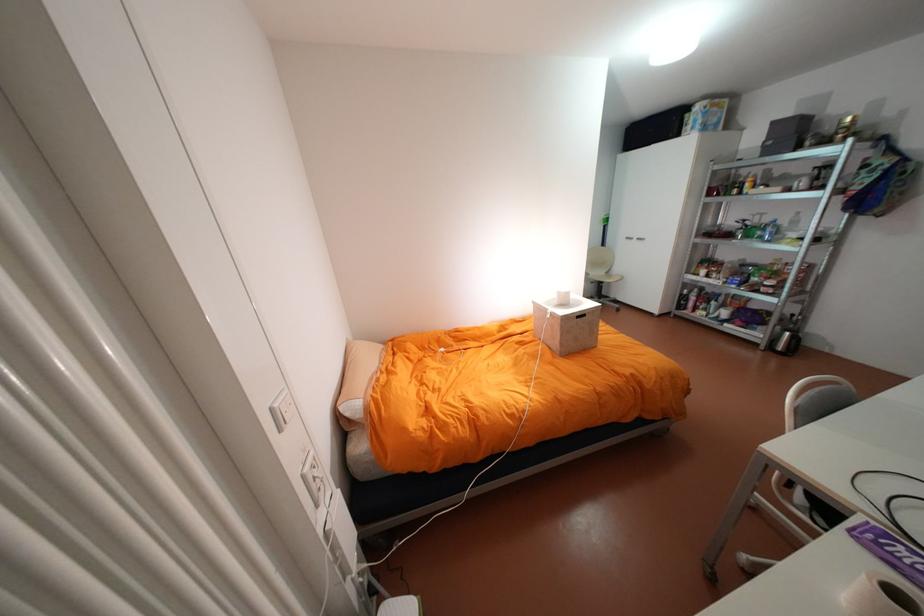
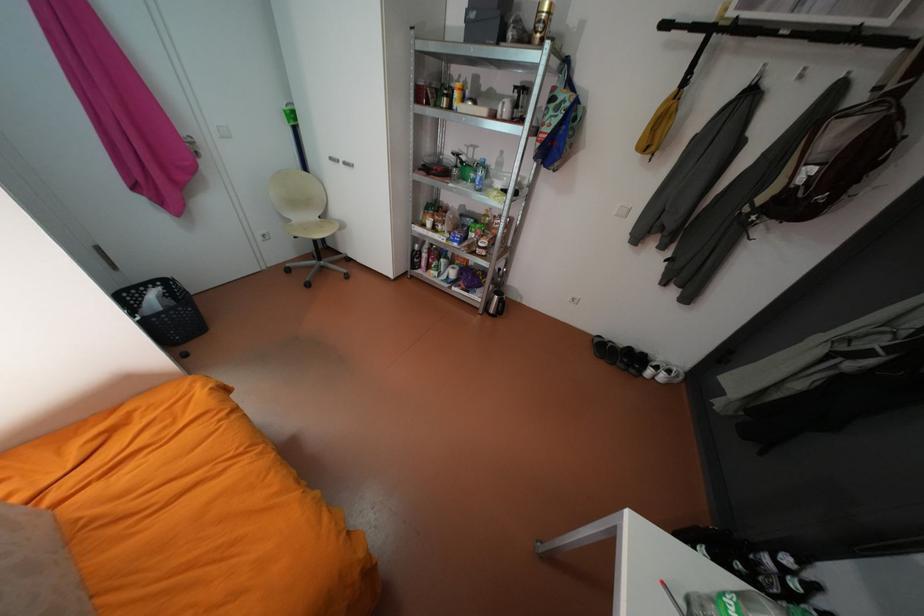
Where in the second image is the point corresponding to (x=689, y=306) from the first image?

(423, 265)